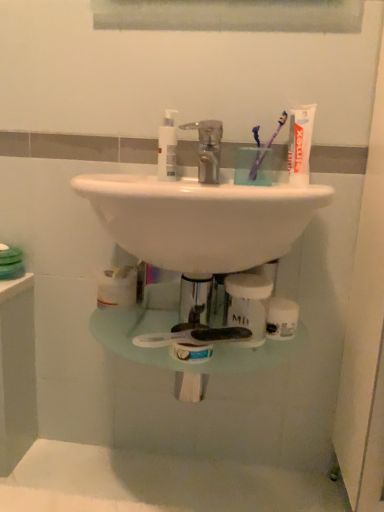
Question: Is white matte tube of toothpaste at upper right taller or shorter than polished chrome faucet at center?

Choices:
 (A) short
 (B) tall

Answer: (B)

Question: In terms of size, does white matte tube of toothpaste at upper right appear bigger or smaller than polished chrome faucet at center?

Choices:
 (A) small
 (B) big

Answer: (A)

Question: Which object is positioned farthest from the polished chrome faucet at center?

Choices:
 (A) white glossy sink at center
 (B) purple plastic toothbrush at upper right, which is the 1th toothbrush in right-to-left order
 (C) white matte tube of toothpaste at upper right
 (D) white plastic pump bottle at center, the second toiletry when ordered from bottom to top
 (E) clear plastic jar at center, which is the second toiletry from left to right

Answer: (E)

Question: Which object is the farthest from the white glossy sink at center?

Choices:
 (A) polished chrome faucet at center
 (B) white matte tube of toothpaste at upper right
 (C) white plastic pump bottle at center, which is counted as the 1th toiletry, starting from the left
 (D) purple translucent toothbrush at upper center, which is the 2th toothbrush in right-to-left order
 (E) purple plastic toothbrush at upper right, which ranks as the second toothbrush in left-to-right order

Answer: (D)